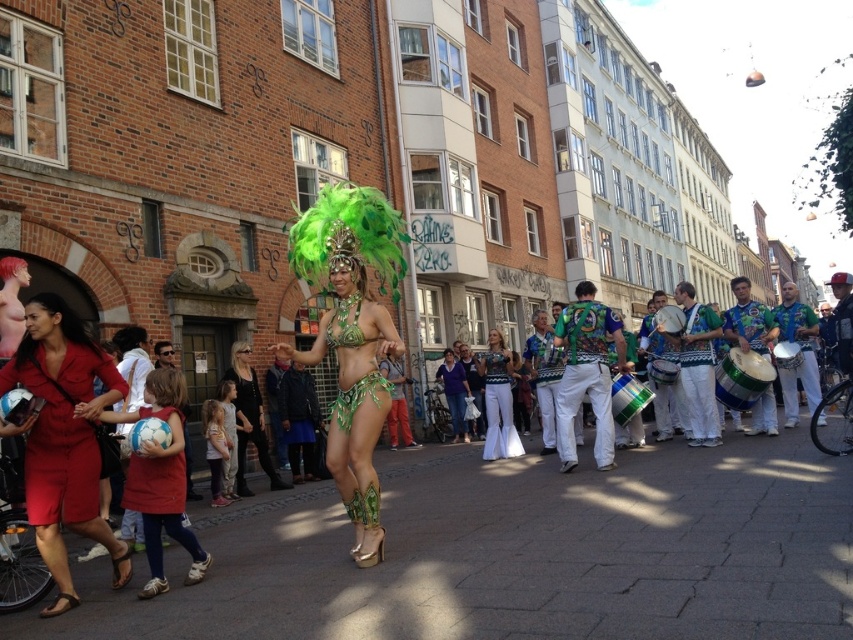
You are standing on the street and want to walk from point A to point B. Point A is at coordinate point (729, 394) and point B is at coordinate point (622, 374). Which point is closer to you when you start walking?

Point A at coordinate point (729, 394) is closer to you because it is further to the viewer than point B at coordinate point (622, 374).

In the scene shown: You are a photographer trying to capture the vibrant street scene. You notice the white textured pants at center and the green fabric drum at center. Which object would require a wider shot to fully capture its width?

The white textured pants at center would require a wider shot because its width is larger than the green fabric drum at center.

You are a photographer standing at the edge of the street. You need to capture a photo of the white textured pants at center and the green fabric drum at center. Which object should you focus on first if you want to ensure both are in the frame without moving the camera?

You should focus on the white textured pants at center first because it is taller than the green fabric drum at center, ensuring it fits within the frame while the drum remains visible.